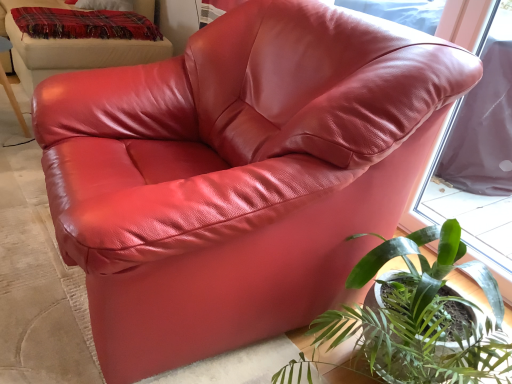
Question: Does satin red bean bag at upper right lie in front of green leafy plant at lower right?

Choices:
 (A) no
 (B) yes

Answer: (A)

Question: Considering the relative sizes of satin red bean bag at upper right and green leafy plant at lower right in the image provided, is satin red bean bag at upper right bigger than green leafy plant at lower right?

Choices:
 (A) yes
 (B) no

Answer: (A)

Question: Can you confirm if satin red bean bag at upper right is thinner than green leafy plant at lower right?

Choices:
 (A) no
 (B) yes

Answer: (A)

Question: From a real-world perspective, is satin red bean bag at upper right located beneath green leafy plant at lower right?

Choices:
 (A) no
 (B) yes

Answer: (A)

Question: Can you confirm if satin red bean bag at upper right is positioned to the left of green leafy plant at lower right?

Choices:
 (A) yes
 (B) no

Answer: (A)

Question: Considering the positions of satin red bean bag at upper right and plaid woolen blanket at upper left in the image, is satin red bean bag at upper right bigger or smaller than plaid woolen blanket at upper left?

Choices:
 (A) big
 (B) small

Answer: (A)

Question: Is satin red bean bag at upper right inside or outside of plaid woolen blanket at upper left?

Choices:
 (A) inside
 (B) outside

Answer: (B)

Question: In terms of width, does satin red bean bag at upper right look wider or thinner when compared to plaid woolen blanket at upper left?

Choices:
 (A) wide
 (B) thin

Answer: (A)

Question: Is satin red bean bag at upper right in front of or behind plaid woolen blanket at upper left in the image?

Choices:
 (A) front
 (B) behind

Answer: (A)

Question: Considering the positions of satin red bean bag at upper right and green leafy plant at lower right in the image, is satin red bean bag at upper right taller or shorter than green leafy plant at lower right?

Choices:
 (A) short
 (B) tall

Answer: (B)

Question: Considering the relative positions of satin red bean bag at upper right and green leafy plant at lower right in the image provided, is satin red bean bag at upper right to the left or to the right of green leafy plant at lower right?

Choices:
 (A) left
 (B) right

Answer: (A)

Question: In terms of width, does satin red bean bag at upper right look wider or thinner when compared to green leafy plant at lower right?

Choices:
 (A) thin
 (B) wide

Answer: (B)

Question: Does point (29, 49) appear closer or farther from the camera than point (415, 314)?

Choices:
 (A) farther
 (B) closer

Answer: (A)

Question: Is plaid woolen blanket at upper left in front of or behind green leafy plant at lower right in the image?

Choices:
 (A) front
 (B) behind

Answer: (B)

Question: Is plaid woolen blanket at upper left situated inside green leafy plant at lower right or outside?

Choices:
 (A) inside
 (B) outside

Answer: (B)